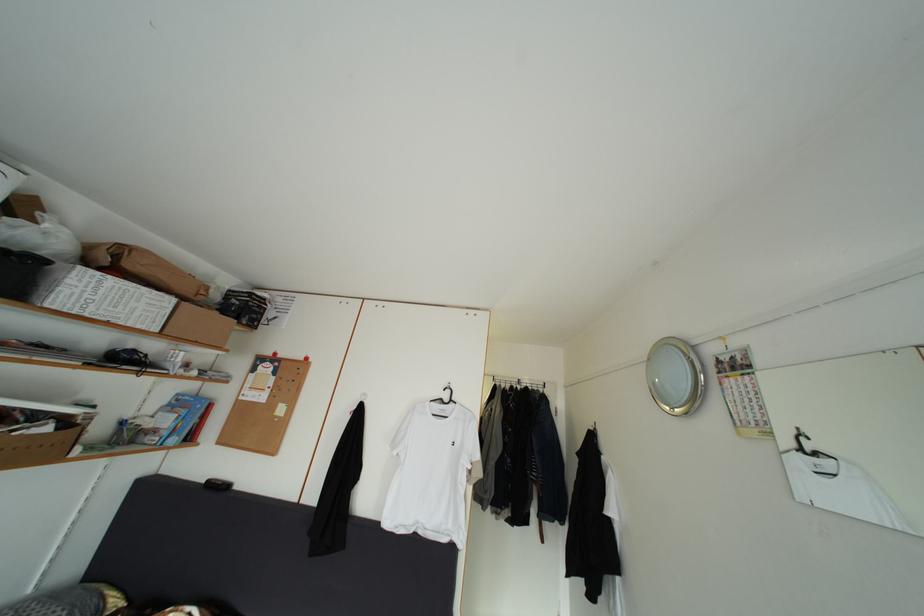
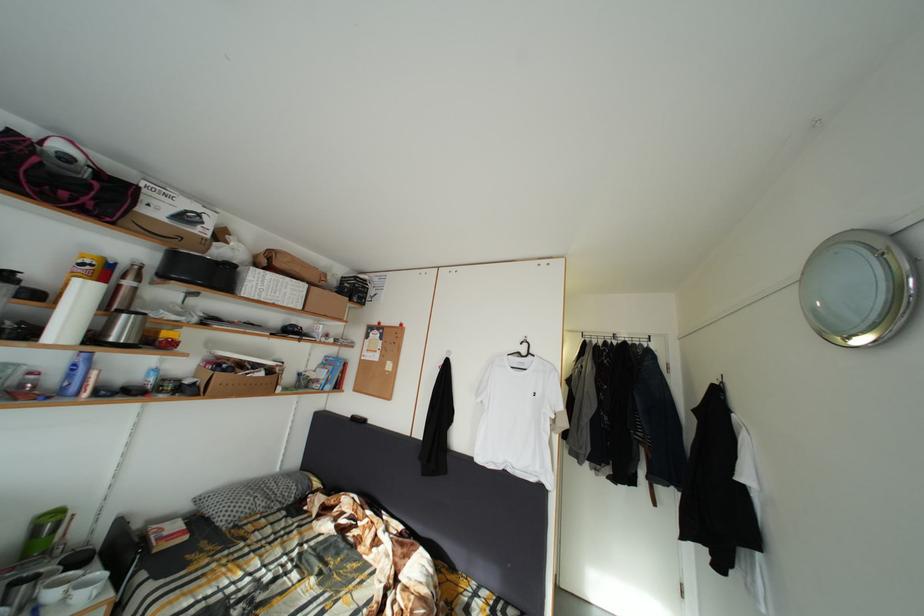
Question: The camera is either moving clockwise (left) or counter-clockwise (right) around the object. The first image is from the beginning of the video and the second image is from the end. Is the camera moving left or right when shooting the video?

Choices:
 (A) Left
 (B) Right

Answer: (B)